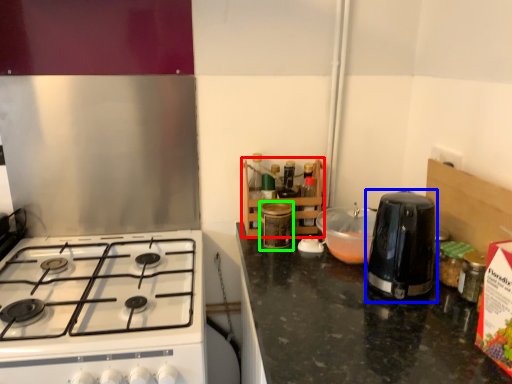
Question: Which is nearer to the shelf (highlighted by a red box)? kitchen appliance (highlighted by a blue box) or kitchen appliance (highlighted by a green box).

Choices:
 (A) kitchen appliance
 (B) kitchen appliance

Answer: (B)